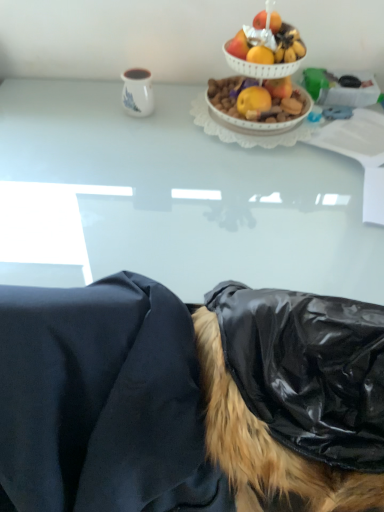
Locate an element on the screen. vacant space to the right of white ceramic mug at upper center is located at coordinates (183, 116).